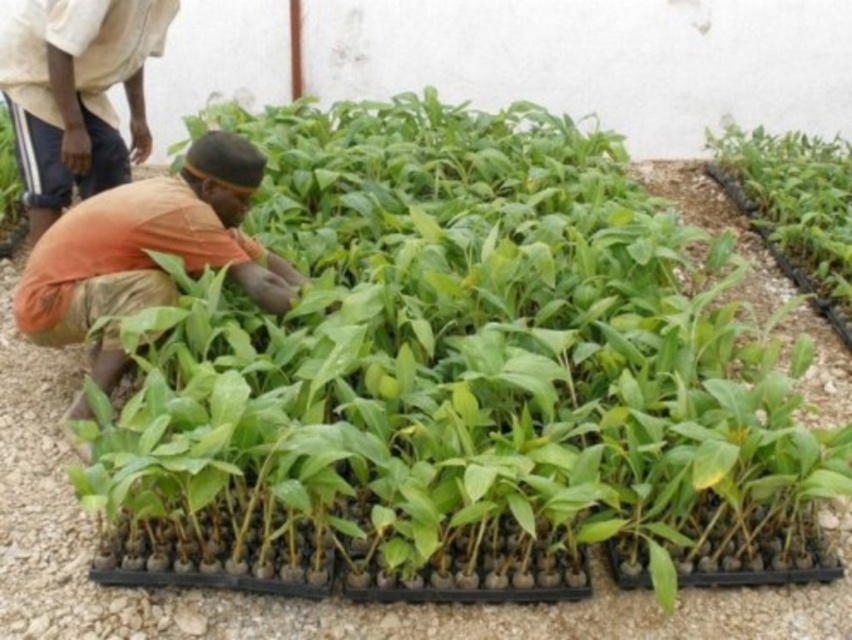
You are a gardener in the greenhouse and need to water the green leafy plant at upper right and the green leafy plant at center. Which one do you need to water first if you want to start with the one closer to you?

You should water the green leafy plant at upper right first because it is closer to the viewer than the green leafy plant at center.

You are a gardener looking at the greenhouse scene. You see an orange fabric at center and a green leafy plant at upper right. Which object is positioned higher in the image?

The green leafy plant at upper right is positioned higher in the image than the orange fabric at center.

You are standing in the greenhouse and want to reach both the point at coordinates (84, 268) and the point at coordinates (130, 141). Which point should you reach for first if you want to touch the closer one first?

Point (84, 268) is closer to you than point (130, 141), so you should reach for point (84, 268) first.